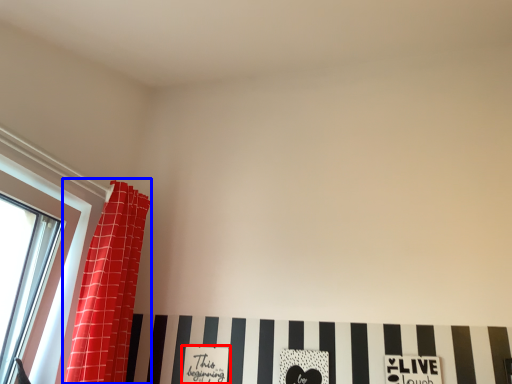
Question: Which point is further to the camera, print (highlighted by a red box) or curtain (highlighted by a blue box)?

Choices:
 (A) print
 (B) curtain

Answer: (A)